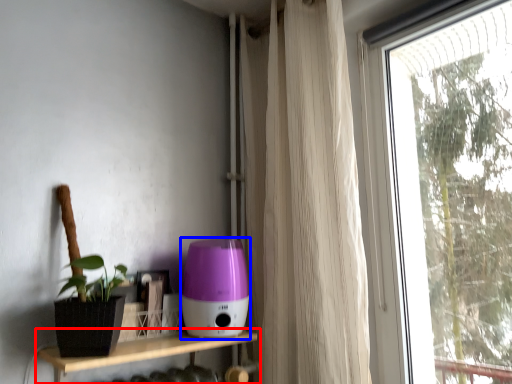
Question: Which of the following is the closest to the observer, shelf (highlighted by a red box) or appliance (highlighted by a blue box)?

Choices:
 (A) shelf
 (B) appliance

Answer: (A)